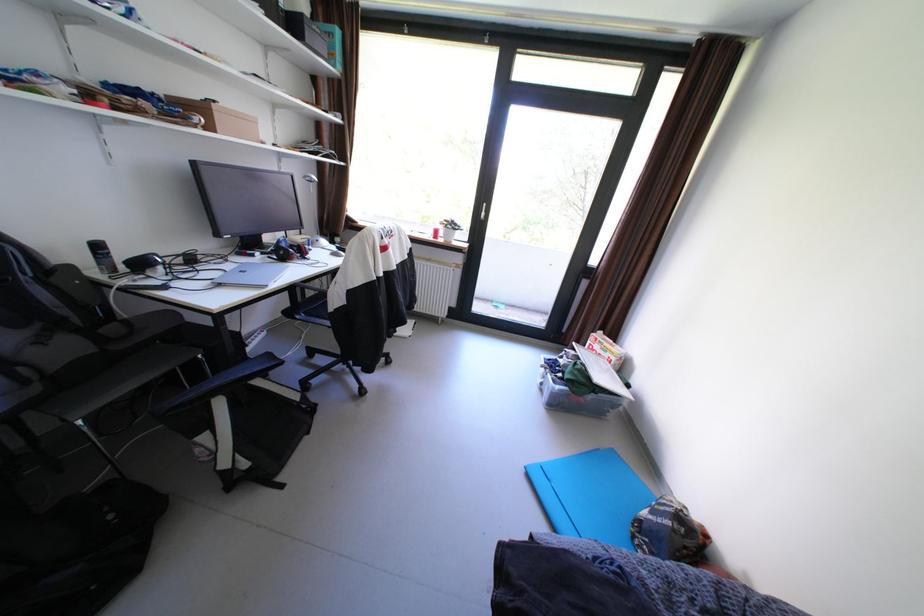
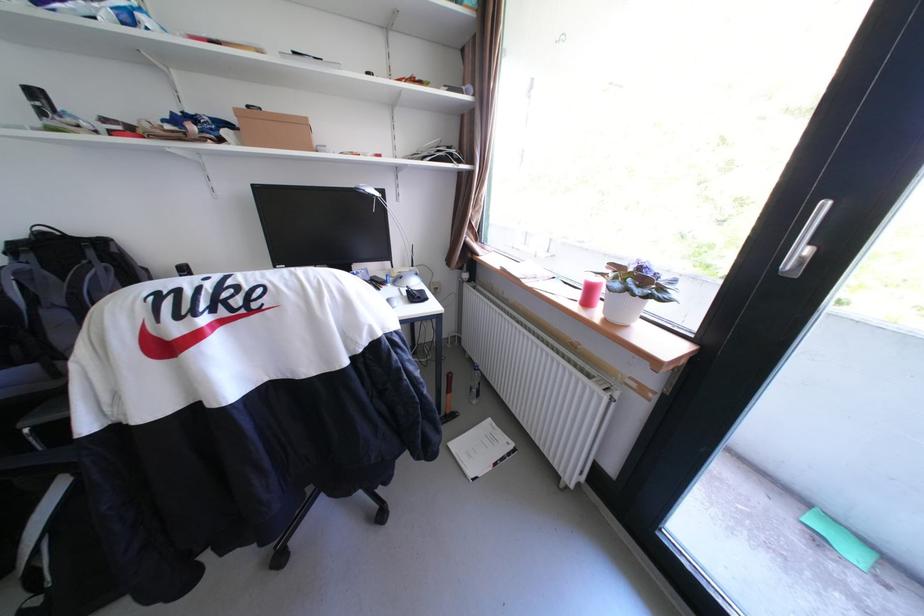
Question: I am providing you with two images of the same scene from different viewpoints. After the viewpoint changes to image2, which objects are now occluded?

Choices:
 (A) silver door handle
 (B) white flower pot
 (C) dish soap pump
 (D) black computer mouse

Answer: (D)